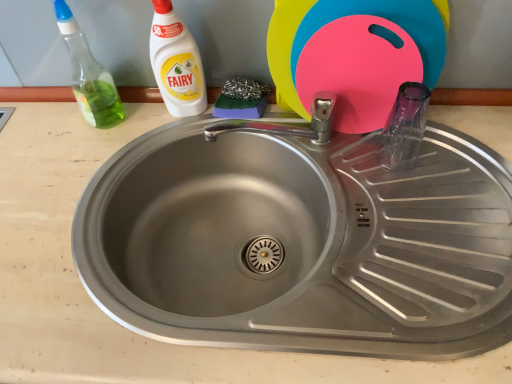
This screenshot has height=384, width=512. I want to click on vacant region to the left of white plastic bottle at upper left, placed as the 2th cleaning product when sorted from left to right, so click(110, 137).